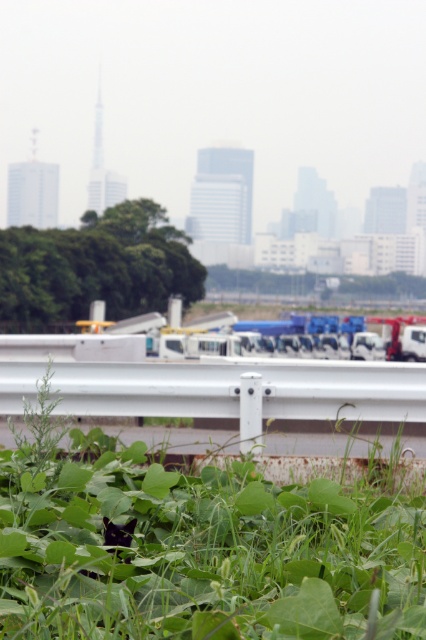
You are standing in the scene and want to walk from the green leafy trees at center to the green leafy grass at lower center. Which direction should you move?

You should move to the right because the green leafy grass at lower center is to the right of the green leafy trees at center.